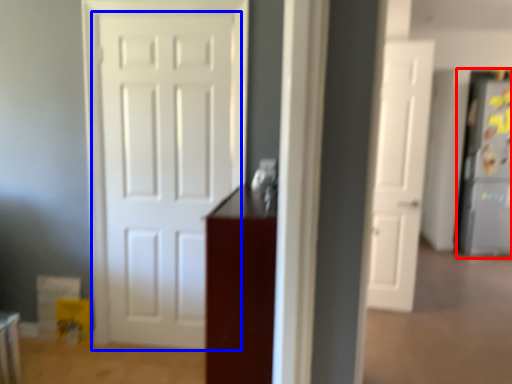
Question: Which of the following is the closest to the observer, fridge (highlighted by a red box) or door (highlighted by a blue box)?

Choices:
 (A) fridge
 (B) door

Answer: (B)